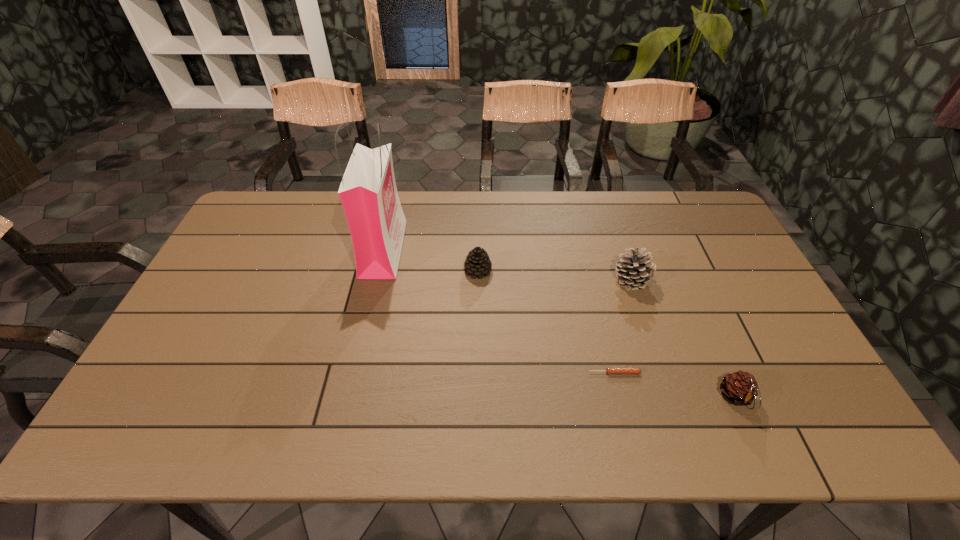
Identify the location of shopping bag. This screenshot has height=540, width=960. (368, 192).

You are a GUI agent. You are given a task and a screenshot of the screen. Output one action in this format:
    pyautogui.click(x=<x>, y=<y>)
    Task: Click on the tallest object
    
    Given the screenshot: What is the action you would take?
    pyautogui.click(x=368, y=192)

This screenshot has height=540, width=960. Find the location of `the fourth shortest object`. the fourth shortest object is located at coordinates (634, 269).

Where is `the tallest pinecone`? The height and width of the screenshot is (540, 960). the tallest pinecone is located at coordinates (634, 269).

This screenshot has height=540, width=960. I want to click on the fourth object from right to left, so click(x=477, y=264).

Locate an element on the screen. the nearest object is located at coordinates (740, 388).

Locate an element on the screen. Image resolution: width=960 pixels, height=540 pixels. the rightmost pinecone is located at coordinates (740, 388).

Where is `sausage`? sausage is located at coordinates (609, 370).

Where is `the second nearest object`? The height and width of the screenshot is (540, 960). the second nearest object is located at coordinates (609, 370).

Find the location of `vacant space situated 0.120m on the front-facing side of the leftmost object`. vacant space situated 0.120m on the front-facing side of the leftmost object is located at coordinates (440, 249).